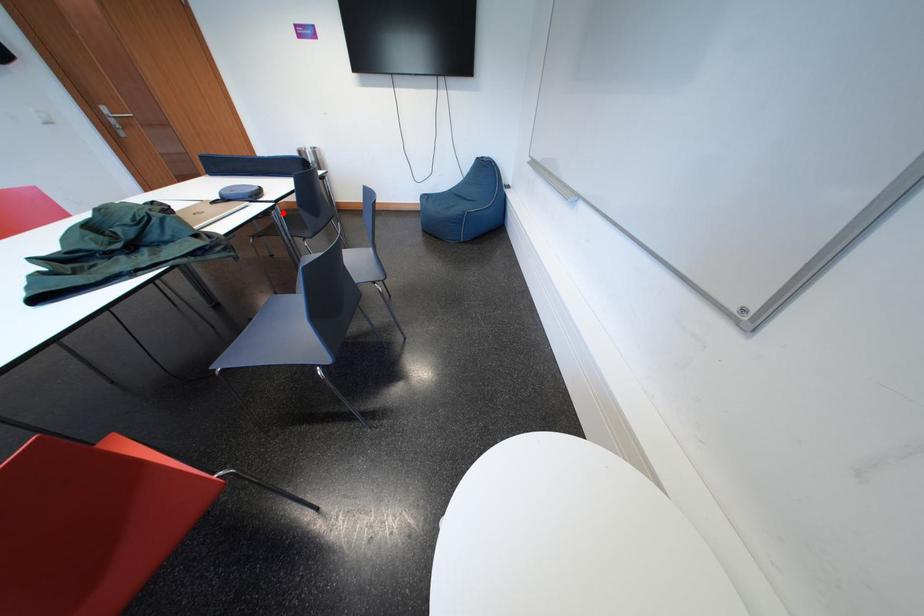
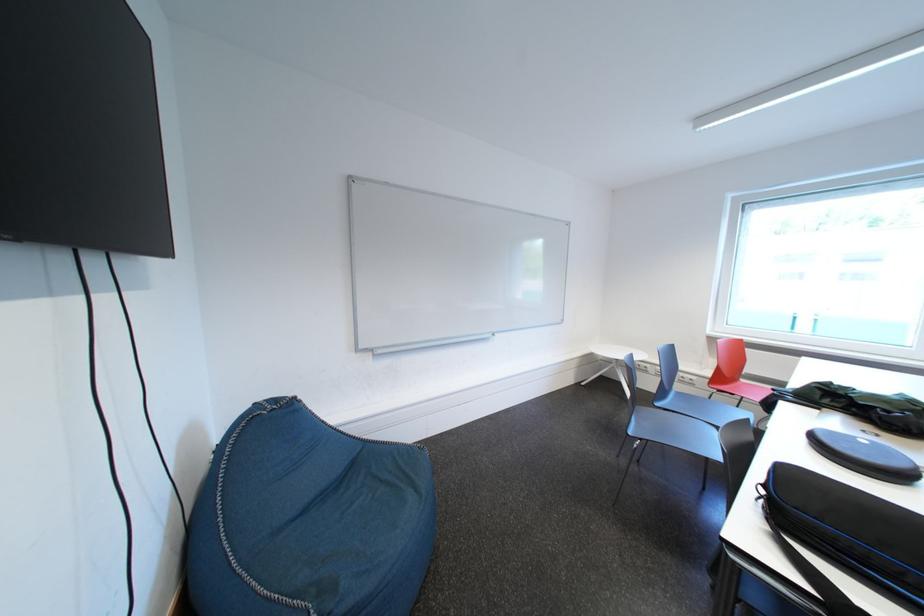
Question: I am providing you with two images of the same scene from different viewpoints. A red point is marked on the first image. Is the red point's position out of view in image 2?

Choices:
 (A) Yes
 (B) No

Answer: (A)